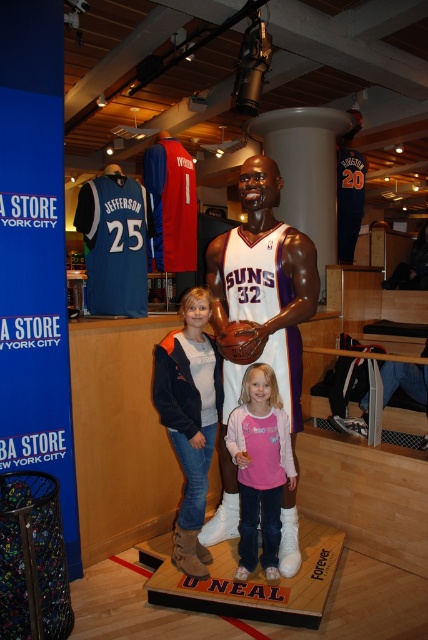
Question: Which of the following is the closest to the observer?

Choices:
 (A) (267, 513)
 (B) (190, 339)

Answer: (B)

Question: Estimate the real-world distances between objects in this image. Which object is closer to the white glossy basketball player at center?

Choices:
 (A) denim jacket at center
 (B) pink fabric shirt at center

Answer: (B)

Question: Is white glossy basketball player at center thinner than pink fabric shirt at center?

Choices:
 (A) no
 (B) yes

Answer: (A)

Question: Does denim jacket at center have a smaller size compared to pink fabric shirt at center?

Choices:
 (A) yes
 (B) no

Answer: (B)

Question: Which of the following is the farthest from the observer?

Choices:
 (A) (240, 317)
 (B) (187, 372)

Answer: (A)

Question: Is white glossy basketball player at center to the left of pink fabric shirt at center from the viewer's perspective?

Choices:
 (A) yes
 (B) no

Answer: (A)